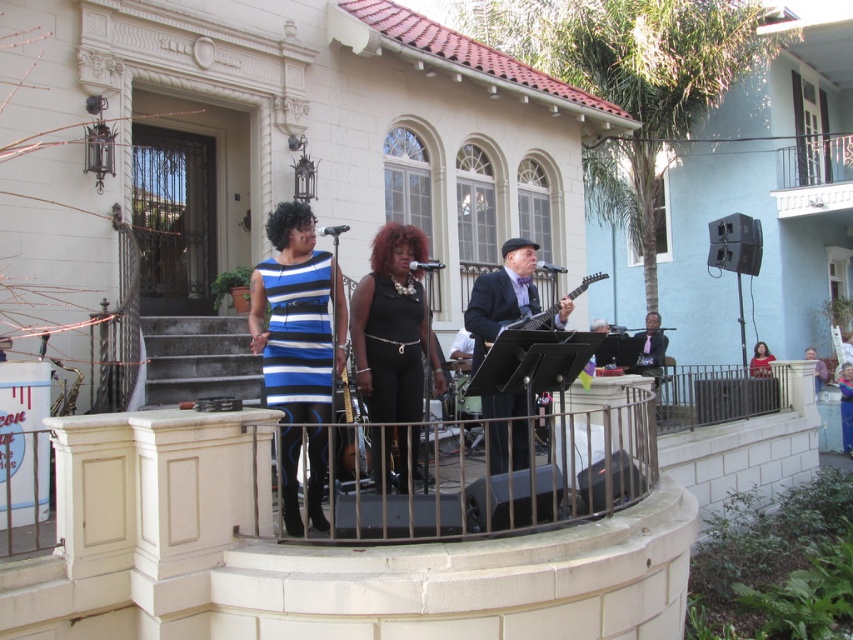
Between blue striped dress at center and black satin dress at center, which one is positioned lower?

black satin dress at center is lower down.

Is blue striped dress at center taller than black satin dress at center?

Correct, blue striped dress at center is much taller as black satin dress at center.

Describe the element at coordinates (297, 317) in the screenshot. The image size is (853, 640). I see `blue striped dress at center` at that location.

This screenshot has width=853, height=640. Identify the location of blue striped dress at center. (297, 317).

Does blue striped dress at center have a lesser height compared to matte black dress at center?

In fact, blue striped dress at center may be taller than matte black dress at center.

Does blue striped dress at center have a greater width compared to matte black dress at center?

Indeed, blue striped dress at center has a greater width compared to matte black dress at center.

Is point (264, 273) closer to viewer compared to point (759, 340)?

Yes, it is.

Locate an element on the screen. Image resolution: width=853 pixels, height=640 pixels. blue striped dress at center is located at coordinates (297, 317).

Measure the distance between point (387, 250) and camera.

A distance of 5.83 meters exists between point (387, 250) and camera.

In the scene shown: Does black satin dress at center have a greater height compared to shiny black guitar at center?

Indeed, black satin dress at center has a greater height compared to shiny black guitar at center.

The image size is (853, 640). I want to click on black satin dress at center, so click(392, 324).